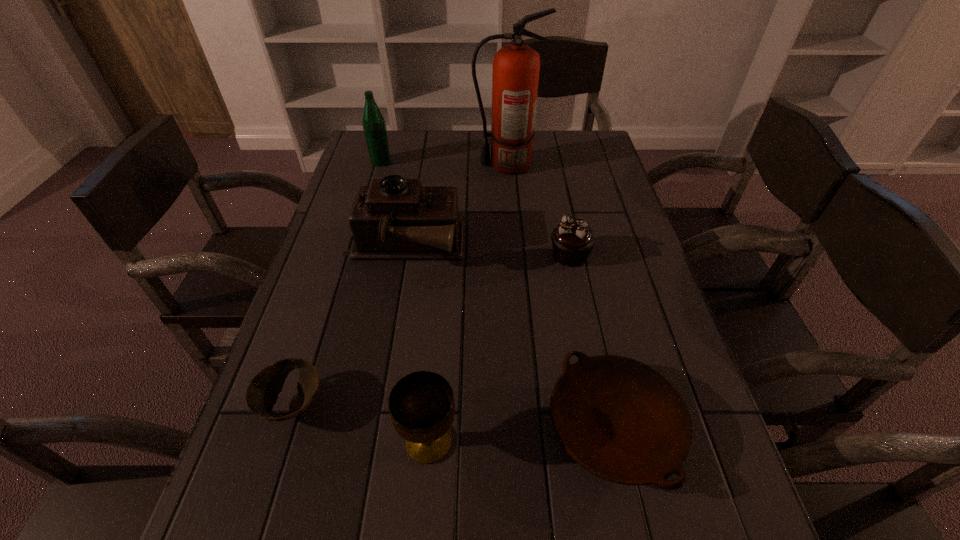
This screenshot has width=960, height=540. I want to click on vacant space in between the fifth tallest object and the sixth shortest object, so click(475, 208).

Where is `unoccupied position between the bottle and the chalice`? This screenshot has width=960, height=540. unoccupied position between the bottle and the chalice is located at coordinates (405, 301).

You are a GUI agent. You are given a task and a screenshot of the screen. Output one action in this format:
    pyautogui.click(x=<x>, y=<y>)
    Task: Click on the vacant area between the bowl and the fifth tallest object
    This screenshot has width=960, height=540.
    Given the screenshot: What is the action you would take?
    pyautogui.click(x=431, y=329)

I want to click on free spot between the chalice and the bottle, so click(x=405, y=301).

Identify the location of free space that is in between the second tallest object and the fourth shortest object. (405, 301).

Find the location of a particular element. object that stands as the fourth closest to the plate is located at coordinates (262, 392).

Select which object appears as the fourth closest to the plate. Please provide its 2D coordinates. Your answer should be formatted as a tuple, i.e. [(x, y)], where the tuple contains the x and y coordinates of a point satisfying the conditions above.

[(262, 392)]

Locate an element on the screen. vacant region that satisfies the following two spatial constraints: 1. on the horn of the phonograph_record; 2. on the back side of the plate is located at coordinates (372, 426).

Locate an element on the screen. free location that satisfies the following two spatial constraints: 1. on the front side of the plate; 2. on the left side of the bowl is located at coordinates (286, 426).

Where is `free location that satisfies the following two spatial constraints: 1. on the back side of the bowl; 2. on the right side of the sixth shortest object`? This screenshot has width=960, height=540. free location that satisfies the following two spatial constraints: 1. on the back side of the bowl; 2. on the right side of the sixth shortest object is located at coordinates (371, 161).